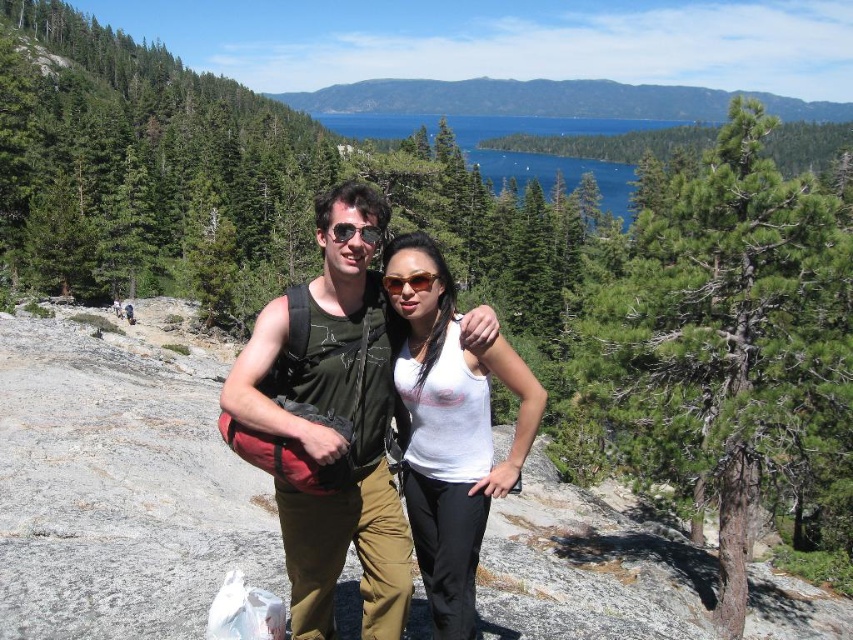
Based on the scene, can you determine which object is shorter between the white matte tank top at center and the green forested mountain at upper center?

The white matte tank top at center is shorter than the green forested mountain at upper center according to the description.

You are a photographer trying to capture a closeup shot of the green fabric backpack at center and the matte black sunglasses at center. Since your camera has a limited focus range, you need to know which object is wider to ensure proper framing. Which one is wider?

The green fabric backpack at center is wider than the matte black sunglasses at center, so you should frame the shot around the backpack first to ensure proper focus and composition.

You are a photographer trying to capture a closeup of the green fabric backpack at center and the matte black sunglasses at center. Which object should you zoom in on first to ensure it fills the frame better?

The green fabric backpack at center is taller than the matte black sunglasses at center, so you should zoom in on the green fabric backpack at center first to ensure it fills the frame better.